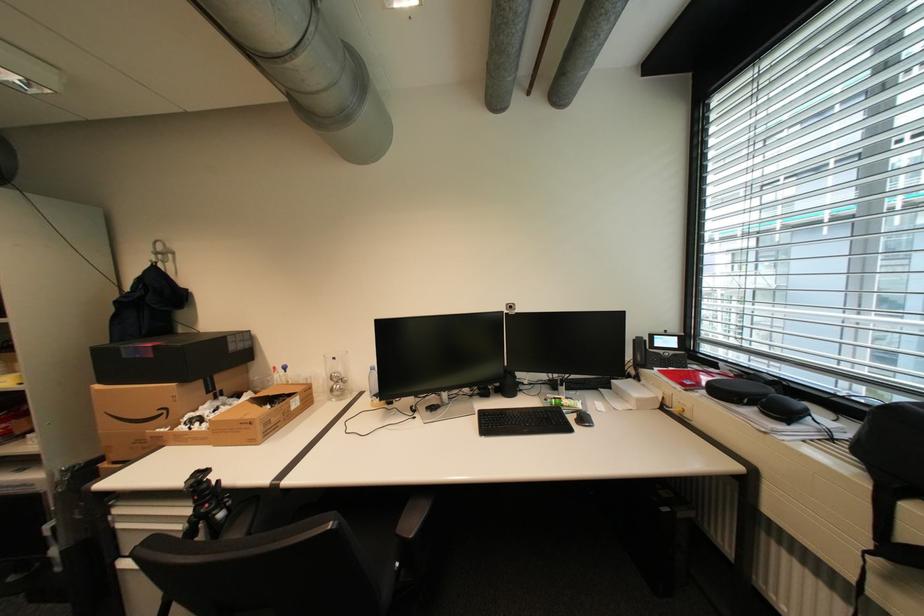
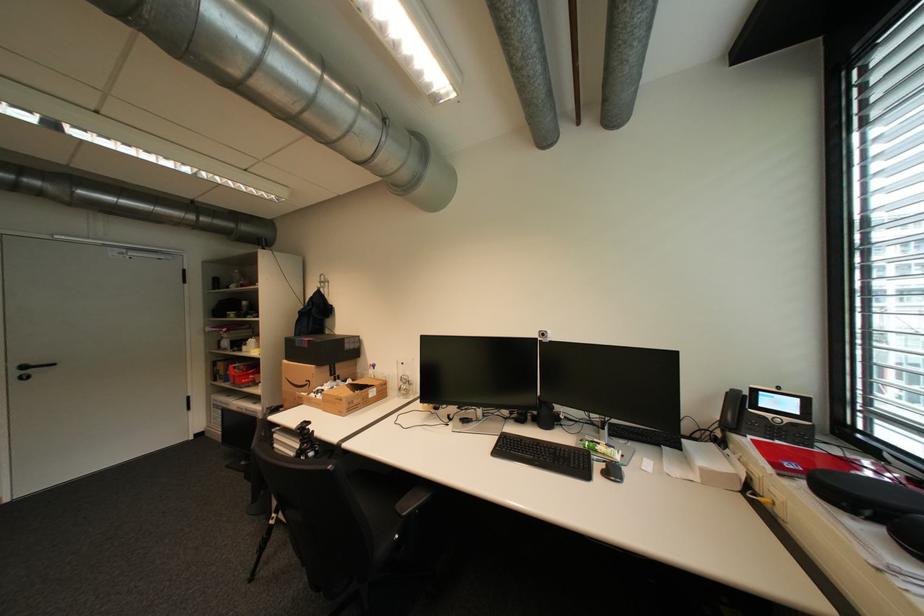
In the second image, find the point that corresponds to [174,411] in the first image.

(317, 383)